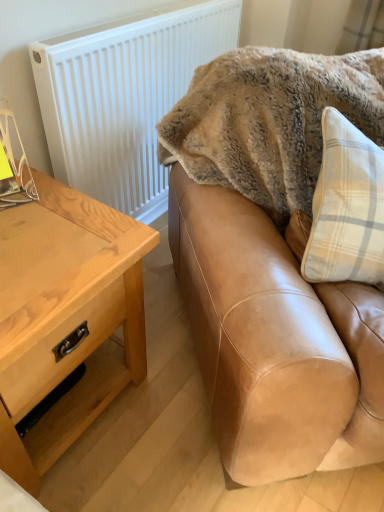
Question: From the image's perspective, does white textured radiator at upper left appear lower than light brown wood table at left?

Choices:
 (A) yes
 (B) no

Answer: (B)

Question: Is white textured radiator at upper left not inside light brown wood table at left?

Choices:
 (A) no
 (B) yes

Answer: (B)

Question: Considering the relative positions of white textured radiator at upper left and light brown wood table at left in the image provided, is white textured radiator at upper left to the left of light brown wood table at left from the viewer's perspective?

Choices:
 (A) no
 (B) yes

Answer: (A)

Question: Is white textured radiator at upper left positioned far away from light brown wood table at left?

Choices:
 (A) yes
 (B) no

Answer: (B)

Question: Considering the relative sizes of white textured radiator at upper left and light brown wood table at left in the image provided, is white textured radiator at upper left taller than light brown wood table at left?

Choices:
 (A) no
 (B) yes

Answer: (B)

Question: Can you confirm if white textured radiator at upper left is positioned to the right of light brown wood table at left?

Choices:
 (A) no
 (B) yes

Answer: (B)

Question: From a real-world perspective, is light brown wood table at left below tan leather couch at upper right?

Choices:
 (A) no
 (B) yes

Answer: (B)

Question: Can you confirm if light brown wood table at left is smaller than tan leather couch at upper right?

Choices:
 (A) yes
 (B) no

Answer: (A)

Question: Is light brown wood table at left closer to camera compared to tan leather couch at upper right?

Choices:
 (A) yes
 (B) no

Answer: (B)

Question: Can you confirm if light brown wood table at left is wider than tan leather couch at upper right?

Choices:
 (A) no
 (B) yes

Answer: (A)

Question: Is light brown wood table at left thinner than tan leather couch at upper right?

Choices:
 (A) no
 (B) yes

Answer: (B)

Question: Is light brown wood table at left oriented away from tan leather couch at upper right?

Choices:
 (A) yes
 (B) no

Answer: (B)

Question: From a real-world perspective, does light brown wood table at left sit lower than fuzzy beige blanket at upper right?

Choices:
 (A) no
 (B) yes

Answer: (B)